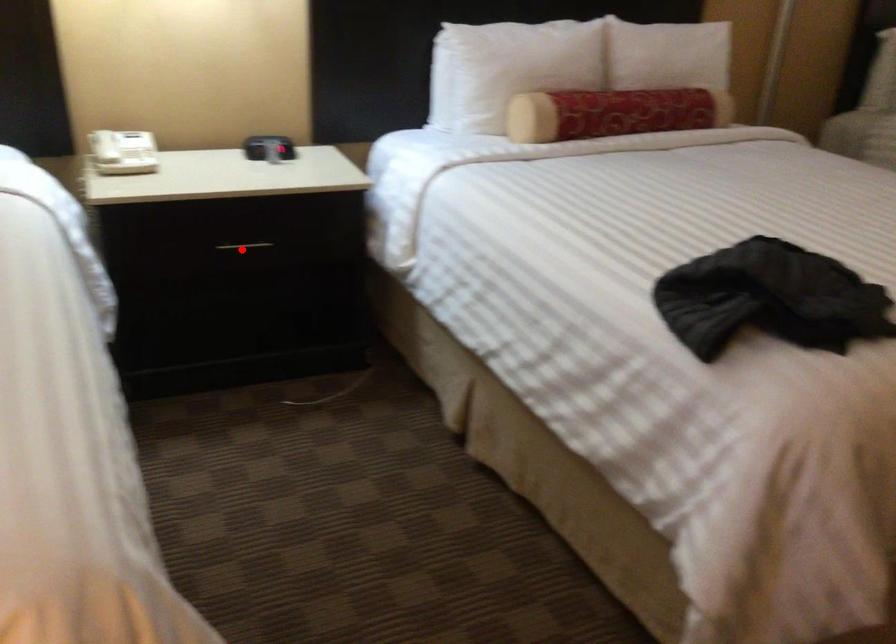
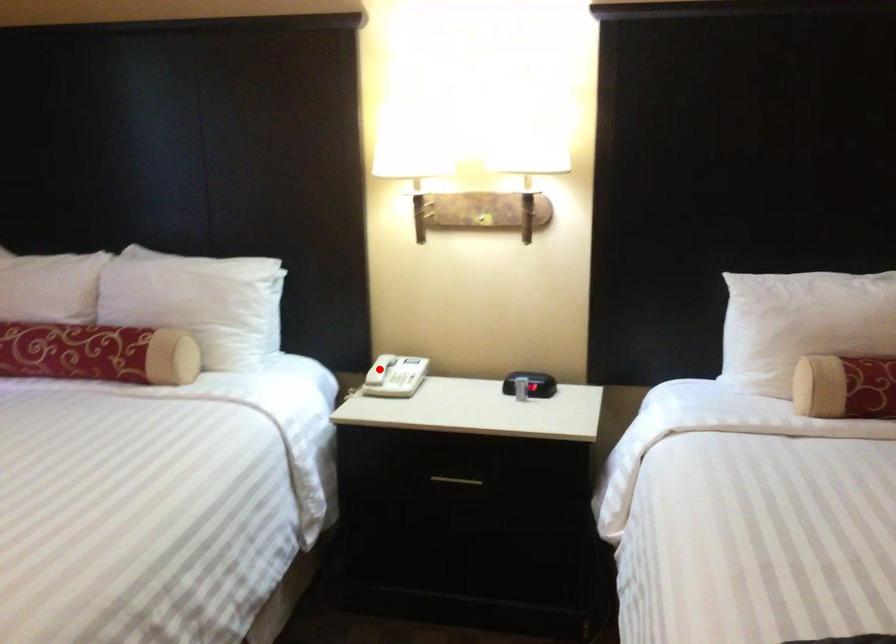
I am providing you with two images of the same scene from different viewpoints. A red point is marked on the first image and another point is marked on the second image. Does the point marked in image1 correspond to the same location as the one in image2?

No